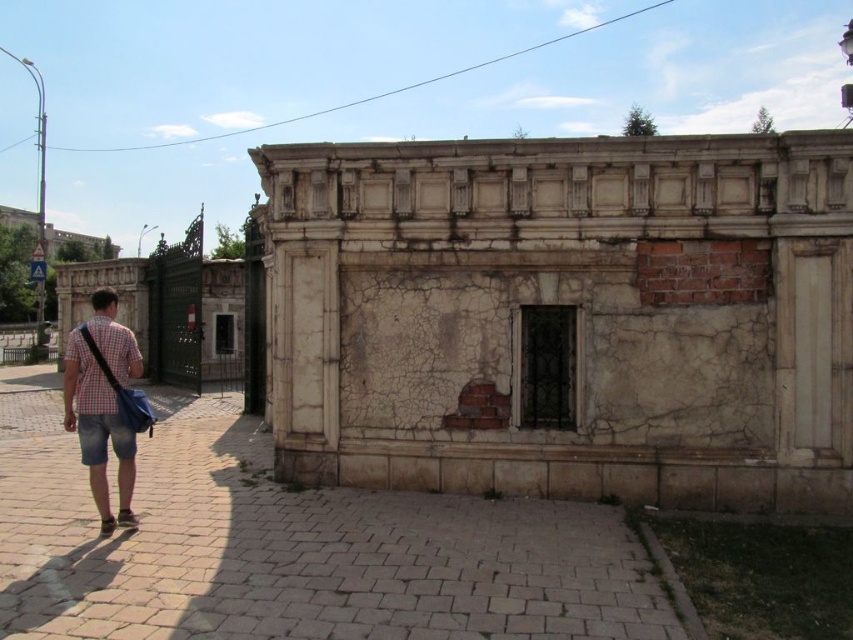
You are standing in the urban scene and want to walk towards the brick pavement at lower center. Which direction should you move relative to the checkered fabric shirt at left?

To reach the brick pavement at lower center, you should move to the right of the checkered fabric shirt at left since the brick pavement at lower center is located to the right of it.